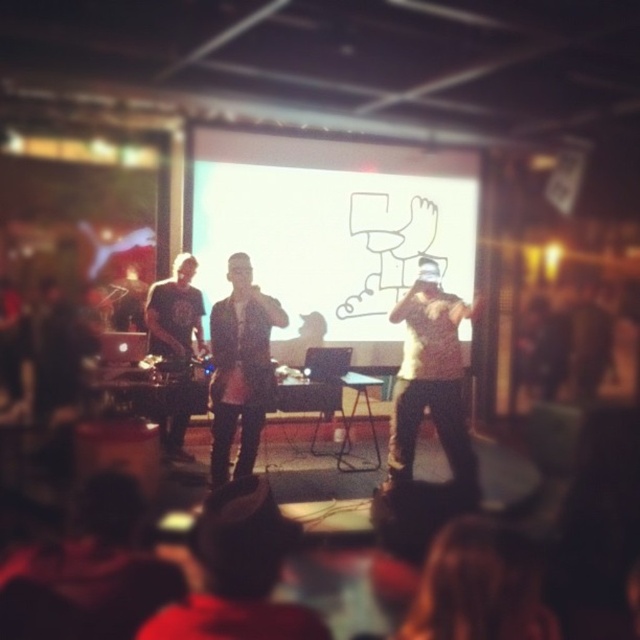
You are an event organizer who needs to set up a new projector. The projector can only project images onto surfaces larger than the dark gray fabric shirt at left. Based on the scene, can the white matte projection screen at center be used with this projector?

The white matte projection screen at center is bigger than the dark gray fabric shirt at left, so yes, the projector can use the white matte projection screen at center since it meets the size requirement of being larger than the dark gray fabric shirt at left.

You are an event organizer who needs to adjust the lighting for the stage. The white matte projection screen at center and the dark gray fabric shirt at left are both in the spotlight. Since the screen is farther away, will its brightness need to be adjusted differently compared to the shirt?

The white matte projection screen at center is 4.09 feet away from dark gray fabric shirt at left. Since the screen is farther away, its brightness should be increased to ensure it is visible from the audience seats.

You are a photographer setting up for the event. You need to place a spotlight on the stage so that it can illuminate both the dark gray leather jacket at center and the dark gray fabric shirt at left simultaneously. Given that the spotlight has a 45 degree spread angle, what is the minimum distance from the stage floor where you should position the spotlight to ensure both objects are fully lit?

The dark gray leather jacket at center and dark gray fabric shirt at left are 70.63 centimeters apart. To cover both with a 45 degree spotlight, the minimum distance from the stage floor would be approximately half of the distance between them divided by the tangent of half the angle. Calculating this gives 70.63 cm divided by 2 equals 35.315 cm. Half of 45 degrees is 22.5 degrees, whose tangent is approximately 0.409. Dividing 35.315 cm by 0.409 yields roughly 86.3 cm. Therefore, positioning the spotlight